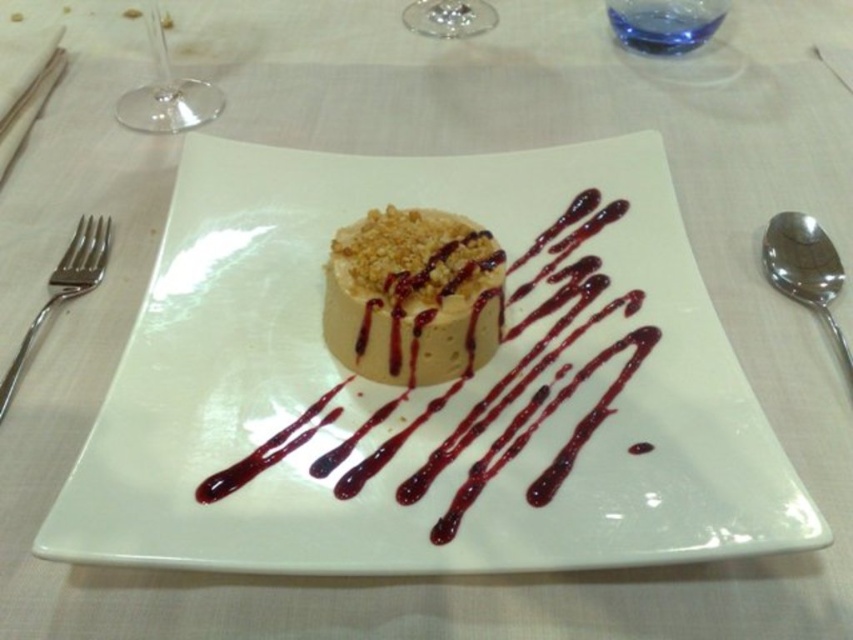
Question: Which object is the farthest from the satin silver fork at left?

Choices:
 (A) transparent glass wine glass at upper left
 (B) transparent glass at upper center

Answer: (B)

Question: Where is smooth caramel cake at center located in relation to transparent glass at upper center in the image?

Choices:
 (A) left
 (B) right

Answer: (A)

Question: Which of the following is the farthest from the observer?

Choices:
 (A) smooth caramel cake at center
 (B) transparent glass wine glass at upper left
 (C) white glossy square plate at center
 (D) matte brown mousse at center

Answer: (B)

Question: Is smooth caramel cake at center further to camera compared to satin silver fork at left?

Choices:
 (A) no
 (B) yes

Answer: (A)

Question: Is satin silver fork at left thinner than transparent glass at upper center?

Choices:
 (A) no
 (B) yes

Answer: (B)

Question: Among these objects, which one is nearest to the camera?

Choices:
 (A) satin silver fork at left
 (B) smooth caramel cake at center
 (C) white glossy square plate at center

Answer: (C)